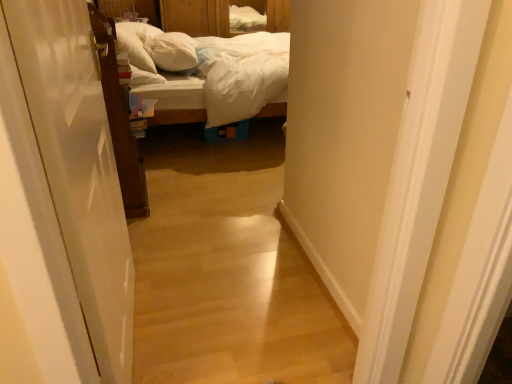
Question: Based on their positions, is white soft pillow at center, placed as the first pillow when sorted from right to left, located to the left or right of white glossy door at left, positioned as the first door in front-to-back order?

Choices:
 (A) left
 (B) right

Answer: (A)

Question: Is white soft pillow at center, placed as the first pillow when sorted from right to left, situated inside white glossy door at left, which is the 1th door from right to left, or outside?

Choices:
 (A) outside
 (B) inside

Answer: (A)

Question: Which is farther from the white soft pillow at upper left, placed as the second pillow when sorted from right to left?

Choices:
 (A) white soft pillow at center, which is counted as the second pillow, starting from the left
 (B) white glossy door at left, which is counted as the 2th door, starting from the back
 (C) wooden bed at center
 (D) brown wooden door at left, the second door from the right

Answer: (B)

Question: Based on their relative distances, which object is farther from the wooden bed at center?

Choices:
 (A) brown wooden door at left, the second door from the right
 (B) white soft pillow at upper left, placed as the second pillow when sorted from right to left
 (C) white glossy door at left, which ranks as the second door in left-to-right order
 (D) white soft pillow at center, which is counted as the second pillow, starting from the left

Answer: (C)